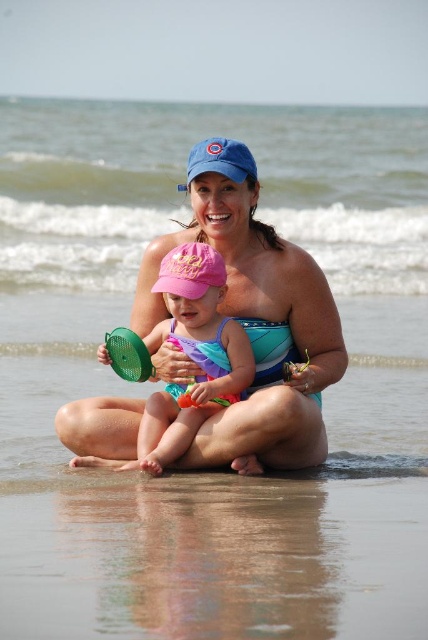
You are a photographer standing at the edge of the beach, and you want to take a photo of the matte blue swim cap at center and the pink fabric swimsuit at center. If your camera can focus on objects within 10 feet, will both items be in focus?

The matte blue swim cap at center is 11.29 feet from the pink fabric swimsuit at center. Since the distance between them exceeds the camera focus range of 10 feet, the camera might not be able to focus on both items simultaneously.

You are a photographer standing at the beach scene. You want to take a closeup photo of the matte blue swim cap at center. Considering the distance, is it possible to capture it clearly without moving closer?

The matte blue swim cap at center is 18.77 meters away from camera. At this distance, capturing a clear closeup photo without moving closer may be challenging due to the distance being quite far.

You are a photographer trying to capture a candid shot of the two subjects in the scene. You want to ensure that the matte blue swim cap at center and the pink fabric swimsuit at center are both visible in the frame. Based on their positions, which object should you position closer to the left side of your camera viewfinder to include both in the shot?

The pink fabric swimsuit at center is to the left of the matte blue swim cap at center. To include both in the frame, position the pink fabric swimsuit at center closer to the left side of the viewfinder so that the matte blue swim cap at center naturally falls to its right within the shot.